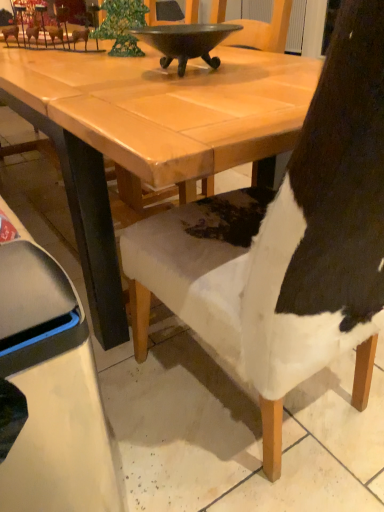
Question: Is shiny dark metal bowl at upper center bigger than white fur chair at center, marked as the second chair in a left-to-right arrangement?

Choices:
 (A) yes
 (B) no

Answer: (B)

Question: Is shiny dark metal bowl at upper center at the right side of white fur chair at center, arranged as the 1th chair when viewed from the right?

Choices:
 (A) yes
 (B) no

Answer: (B)

Question: From a real-world perspective, is shiny dark metal bowl at upper center below white fur chair at center, arranged as the 1th chair when viewed from the right?

Choices:
 (A) no
 (B) yes

Answer: (A)

Question: Is shiny dark metal bowl at upper center wider than white fur chair at center, arranged as the 1th chair when viewed from the right?

Choices:
 (A) yes
 (B) no

Answer: (B)

Question: Does shiny dark metal bowl at upper center have a lesser width compared to white fur chair at center, marked as the second chair in a left-to-right arrangement?

Choices:
 (A) no
 (B) yes

Answer: (B)

Question: Is white fur chair at center, marked as the second chair in a left-to-right arrangement, inside the boundaries of shiny dark metal bowl at upper center, or outside?

Choices:
 (A) outside
 (B) inside

Answer: (A)

Question: Is point (324, 295) closer or farther from the camera than point (155, 47)?

Choices:
 (A) closer
 (B) farther

Answer: (A)

Question: In terms of width, does white fur chair at center, marked as the second chair in a left-to-right arrangement, look wider or thinner when compared to shiny dark metal bowl at upper center?

Choices:
 (A) wide
 (B) thin

Answer: (A)

Question: From a real-world perspective, is white fur chair at center, arranged as the 1th chair when viewed from the right, physically located above or below shiny dark metal bowl at upper center?

Choices:
 (A) below
 (B) above

Answer: (A)

Question: Does point (152, 31) appear closer or farther from the camera than point (72, 485)?

Choices:
 (A) closer
 (B) farther

Answer: (B)

Question: Is shiny dark metal bowl at upper center wider or thinner than white fabric chair at lower right, acting as the 2th chair starting from the right?

Choices:
 (A) wide
 (B) thin

Answer: (B)

Question: From a real-world perspective, relative to white fabric chair at lower right, the 1th chair when ordered from left to right, is shiny dark metal bowl at upper center vertically above or below?

Choices:
 (A) above
 (B) below

Answer: (A)

Question: In terms of size, does shiny dark metal bowl at upper center appear bigger or smaller than white fabric chair at lower right, acting as the 2th chair starting from the right?

Choices:
 (A) small
 (B) big

Answer: (A)

Question: Considering the relative positions of white fur chair at center, marked as the second chair in a left-to-right arrangement, and white fabric chair at lower right, acting as the 2th chair starting from the right, in the image provided, is white fur chair at center, marked as the second chair in a left-to-right arrangement, to the left or to the right of white fabric chair at lower right, acting as the 2th chair starting from the right,?

Choices:
 (A) right
 (B) left

Answer: (A)

Question: From a real-world perspective, is white fur chair at center, marked as the second chair in a left-to-right arrangement, above or below white fabric chair at lower right, the 1th chair when ordered from left to right?

Choices:
 (A) below
 (B) above

Answer: (B)